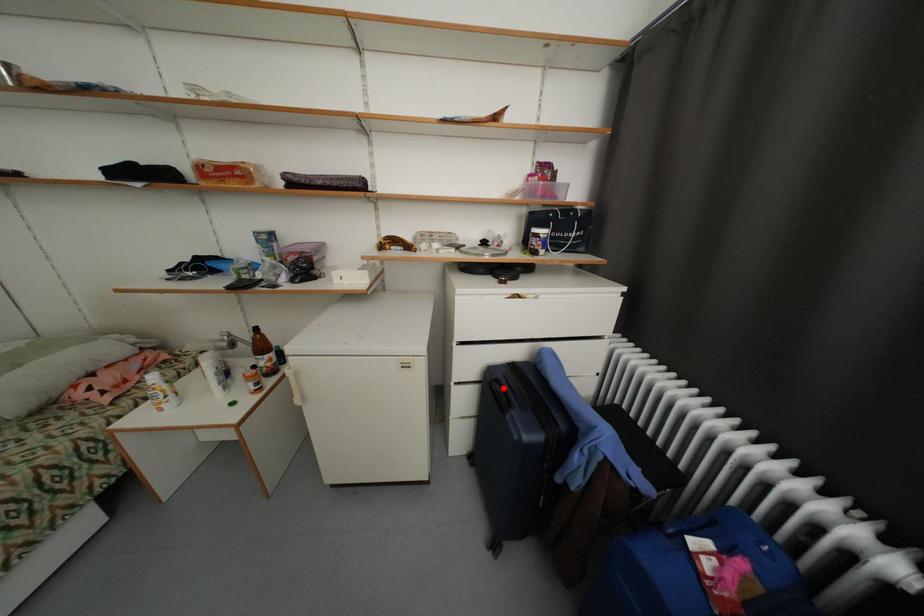
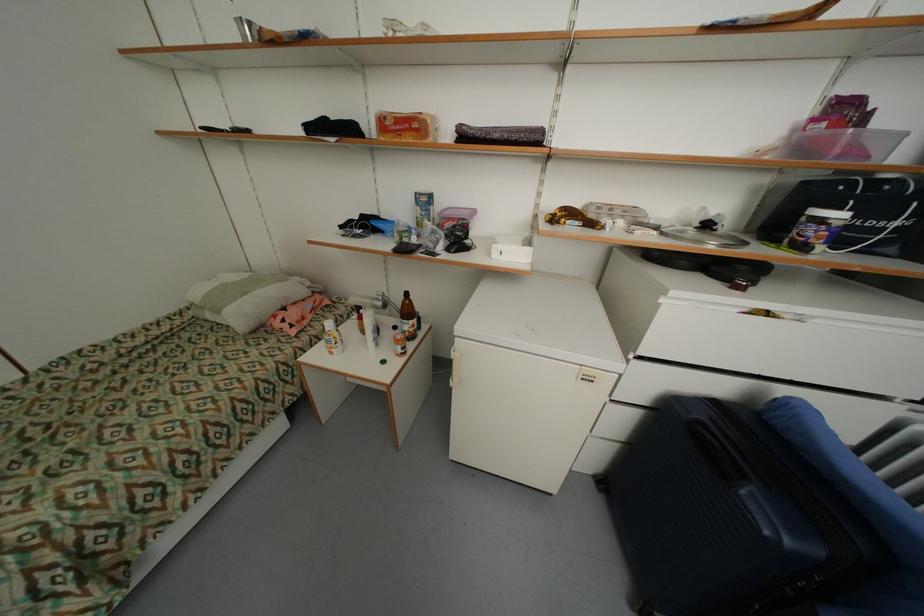
In the second image, find the point that corresponds to the highlighted location in the first image.

(715, 437)